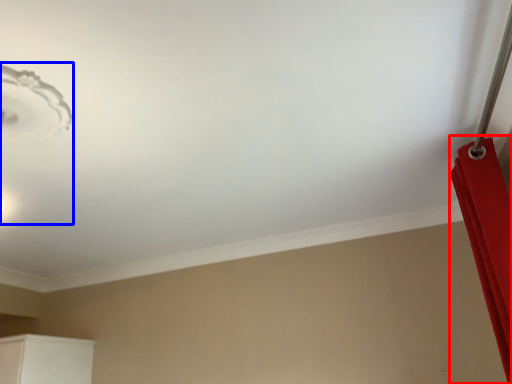
Question: Among these objects, which one is nearest to the camera, curtain (highlighted by a red box) or lamp (highlighted by a blue box)?

Choices:
 (A) curtain
 (B) lamp

Answer: (B)